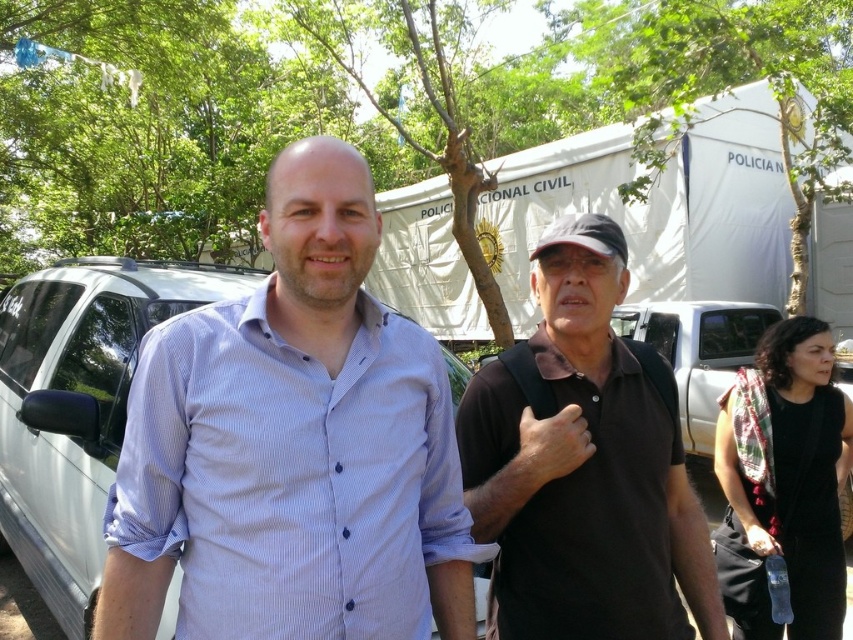
Question: Estimate the real-world distances between objects in this image. Which object is closer to the black matte polo shirt at center?

Choices:
 (A) dry skin at center
 (B) smooth skin hand at lower right

Answer: (A)

Question: Among these objects, which one is farthest from the camera?

Choices:
 (A) dry skin at center
 (B) black matte polo shirt at center
 (C) black fabric dress at lower right

Answer: (C)

Question: Is blue striped shirt at center smaller than dry skin at center?

Choices:
 (A) no
 (B) yes

Answer: (A)

Question: Among these points, which one is nearest to the camera?

Choices:
 (A) (695, 518)
 (B) (418, 332)
 (C) (758, 524)

Answer: (B)

Question: Can you confirm if blue striped shirt at center is wider than black fabric dress at lower right?

Choices:
 (A) yes
 (B) no

Answer: (A)

Question: Is black fabric dress at lower right below smooth skin hand at lower right?

Choices:
 (A) yes
 (B) no

Answer: (B)